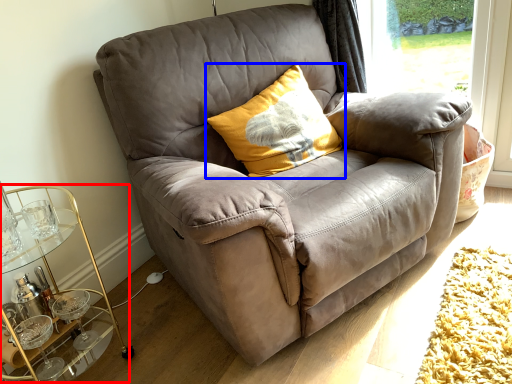
Question: Among these objects, which one is nearest to the camera, cocktail table (highlighted by a red box) or pillow (highlighted by a blue box)?

Choices:
 (A) cocktail table
 (B) pillow

Answer: (A)